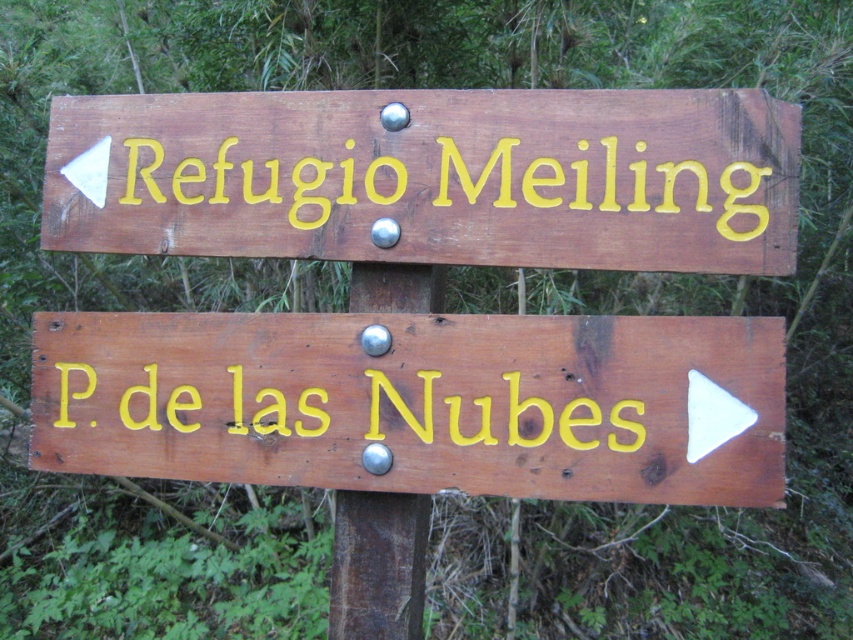
Question: Estimate the real-world distances between objects in this image. Which object is closer to the yellow painted wood at center?

Choices:
 (A) yellow painted wood at upper center
 (B) brown wooden pole at center

Answer: (B)

Question: Can you confirm if yellow painted wood at center is wider than brown wooden pole at center?

Choices:
 (A) yes
 (B) no

Answer: (A)

Question: Is wooden sign at lower right bigger than yellow painted wood at center?

Choices:
 (A) yes
 (B) no

Answer: (A)

Question: Can you confirm if wooden sign at lower right is positioned to the right of brown wooden pole at center?

Choices:
 (A) yes
 (B) no

Answer: (A)

Question: Which of the following is the closest to the observer?

Choices:
 (A) (329, 436)
 (B) (228, 163)

Answer: (A)

Question: Which object appears farthest from the camera in this image?

Choices:
 (A) wooden sign at lower right
 (B) yellow painted wood at upper center
 (C) yellow painted wood at center
 (D) brown wooden pole at center

Answer: (D)